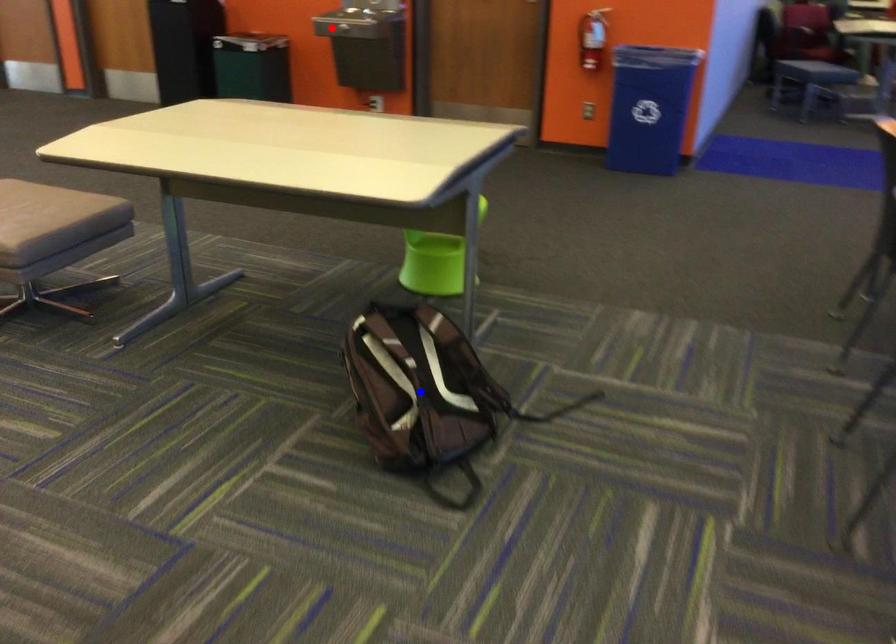
Question: Which of the two points in the image is closer to the camera?

Choices:
 (A) Blue point is closer.
 (B) Red point is closer.

Answer: (A)